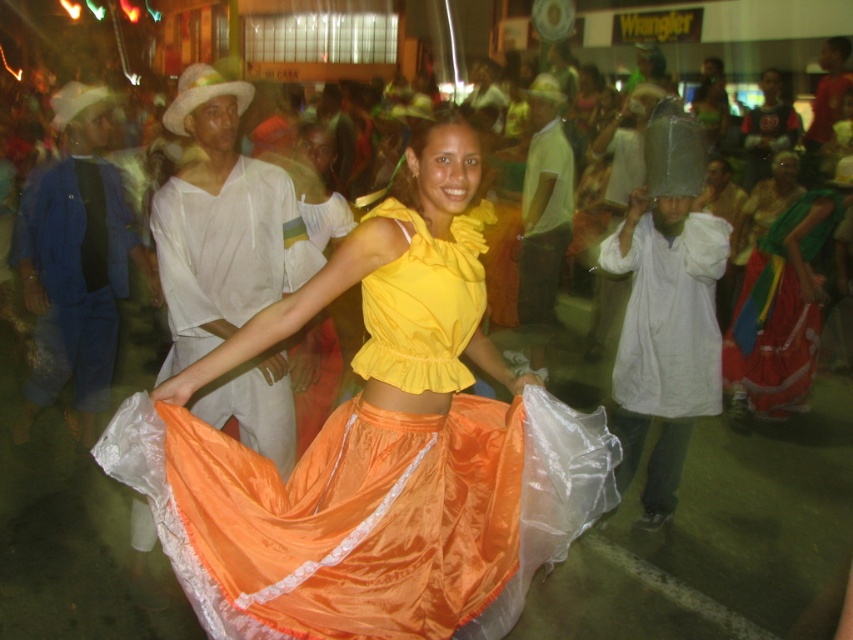
Question: Among these points, which one is nearest to the camera?

Choices:
 (A) (368, 636)
 (B) (732, 381)

Answer: (A)

Question: Which of the following is the farthest from the observer?

Choices:
 (A) (740, 346)
 (B) (407, 516)

Answer: (A)

Question: Is shiny satin skirt at center to the left of silky orange skirt at lower right from the viewer's perspective?

Choices:
 (A) yes
 (B) no

Answer: (A)

Question: Which point is farther to the camera?

Choices:
 (A) (811, 257)
 (B) (462, 572)

Answer: (A)

Question: Does shiny satin skirt at center have a greater width compared to silky orange skirt at lower right?

Choices:
 (A) no
 (B) yes

Answer: (A)

Question: From the image, what is the correct spatial relationship of shiny satin skirt at center in relation to silky orange skirt at lower right?

Choices:
 (A) below
 (B) above

Answer: (A)